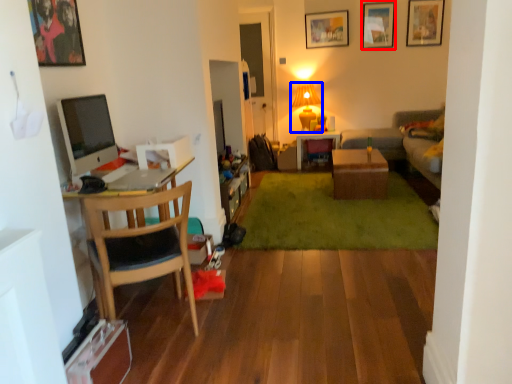
Question: Which object appears closest to the camera in this image, picture frame (highlighted by a red box) or lamp (highlighted by a blue box)?

Choices:
 (A) picture frame
 (B) lamp

Answer: (A)